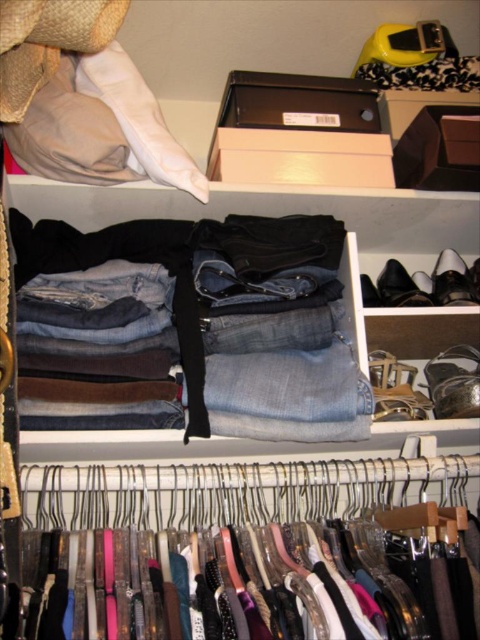
You are organizing items in the closet and need to place a new item at the point that is closer to the front. Which point should you choose between point (288, 616) and point (244, 387)?

Point (288, 616) is in front of point (244, 387), so you should choose point (288, 616) to place the new item closer to the front.

You are organizing a closet and need to place a new item on the shelf where the metallic hangers at center are located. According to the image, where exactly should you place the new item?

The metallic hangers at center are located at position point (249, 540), so you should place the new item at that coordinate.

From the picture: You are organizing your closet and need to reach for the metallic hangers at center and the denim jeans at center. Which item is easier to grab without moving the other?

The metallic hangers at center is closer to the viewer than the denim jeans at center, so it is easier to grab without moving the other.